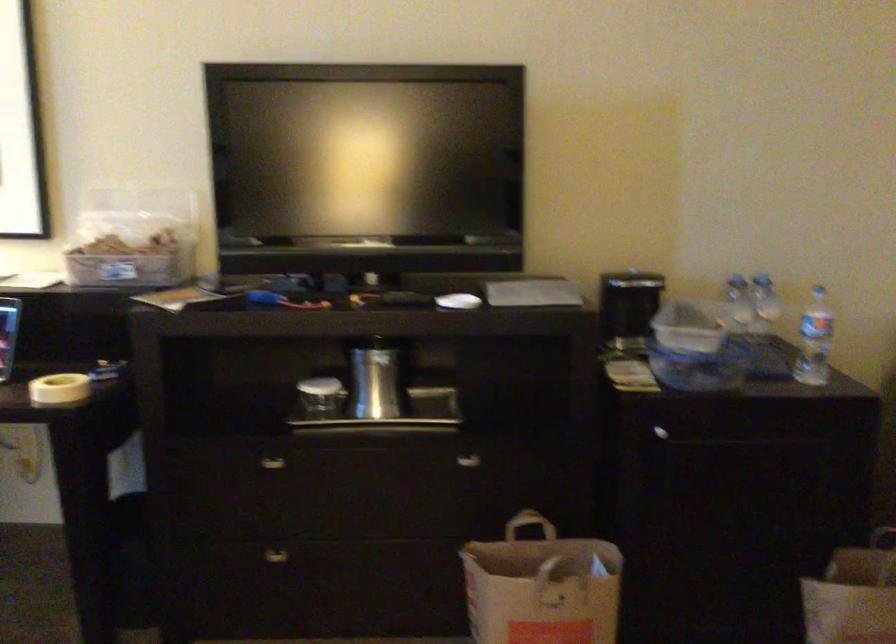
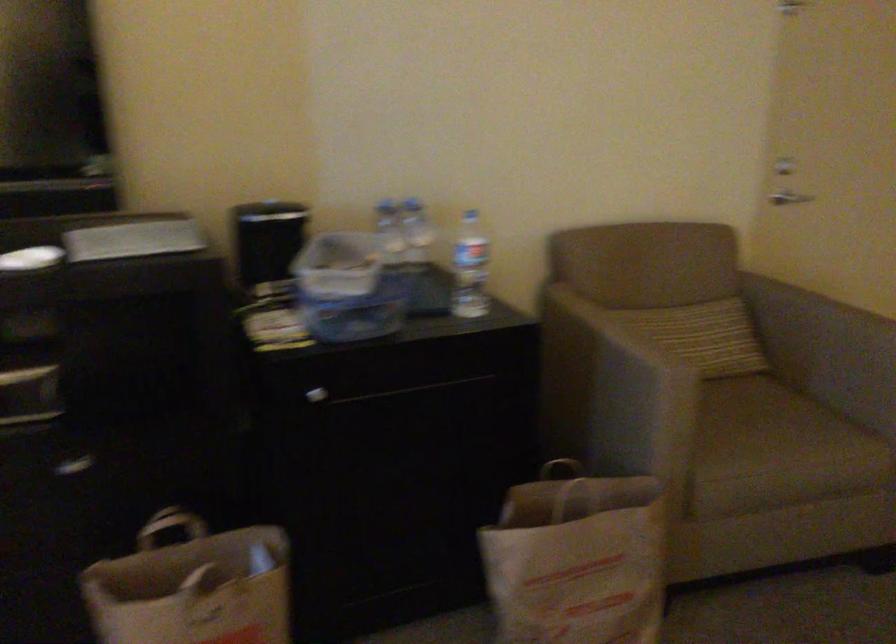
Find the pixel in the second image that matches point (692, 343) in the first image.

(348, 288)